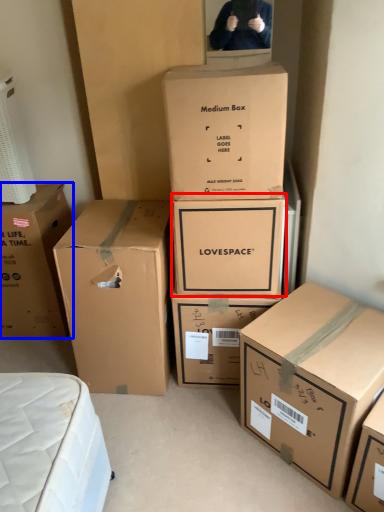
Question: Which of the following is the closest to the observer, box (highlighted by a red box) or box (highlighted by a blue box)?

Choices:
 (A) box
 (B) box

Answer: (A)